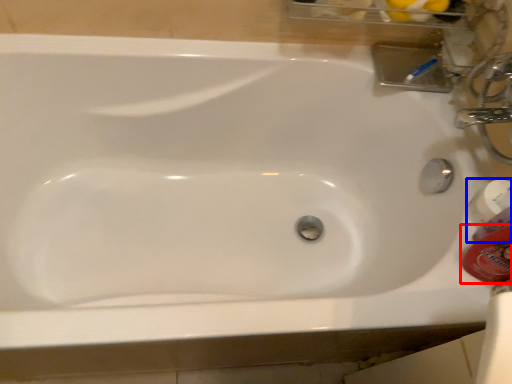
Question: Which point is closer to the camera, mouthwash (highlighted by a red box) or mouthwash (highlighted by a blue box)?

Choices:
 (A) mouthwash
 (B) mouthwash

Answer: (A)